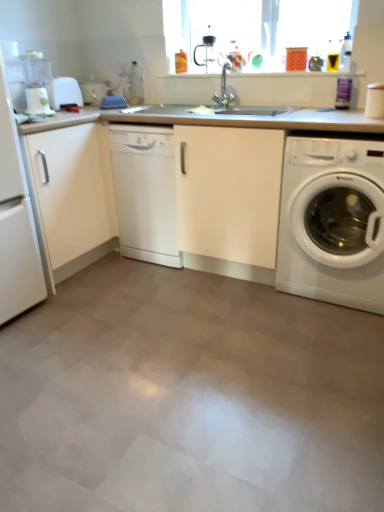
The image size is (384, 512). What do you see at coordinates (259, 195) in the screenshot?
I see `white matte countertop at center` at bounding box center [259, 195].

Consider the image. Measure the distance between point (196, 33) and camera.

2.66 meters.

This screenshot has width=384, height=512. Describe the element at coordinates (64, 92) in the screenshot. I see `white plastic toaster at left, marked as the second appliance in a back-to-front arrangement` at that location.

Find the location of a particular element. Image resolution: width=384 pixels, height=512 pixels. white matte countertop at center is located at coordinates (259, 195).

Considering the points (300, 256) and (322, 56), which point is in front, point (300, 256) or point (322, 56)?

Positioned in front is point (300, 256).

Can you confirm if white matte countertop at center is positioned to the right of transparent glass window screen at upper center?

No, white matte countertop at center is not to the right of transparent glass window screen at upper center.

Is white matte countertop at center inside the boundaries of transparent glass window screen at upper center, or outside?

white matte countertop at center is not inside transparent glass window screen at upper center, it's outside.

Which of these two, white matte countertop at center or transparent glass window screen at upper center, is wider?

white matte countertop at center.

From the image's perspective, is white plastic toaster at left, marked as the second appliance in a back-to-front arrangement, beneath white matte refrigerator at left?

No.

Based on their positions, is white plastic toaster at left, marked as the first appliance in a front-to-back arrangement, located to the left or right of white matte refrigerator at left?

white plastic toaster at left, marked as the first appliance in a front-to-back arrangement, is positioned on white matte refrigerator at left's right side.

Does point (49, 101) lie in front of point (15, 219)?

No.

Is white plastic toaster at left, marked as the first appliance in a front-to-back arrangement, inside or outside of white matte refrigerator at left?

white plastic toaster at left, marked as the first appliance in a front-to-back arrangement, exists outside the volume of white matte refrigerator at left.

Is matte white toaster at upper left, placed as the second appliance when sorted from front to back, positioned with its back to white matte refrigerator at left?

matte white toaster at upper left, placed as the second appliance when sorted from front to back, is not turned away from white matte refrigerator at left.

Find the location of a particular element. This screenshot has height=512, width=384. the 2nd appliance behind the white matte refrigerator at left, starting your count from the anchor is located at coordinates (93, 89).

Is matte white toaster at upper left, placed as the second appliance when sorted from front to back, next to white matte refrigerator at left?

No.

How much distance is there between matte white toaster at upper left, placed as the second appliance when sorted from front to back, and white matte refrigerator at left?

They are 1.15 meters apart.

From a real-world perspective, starting from the white glossy dishwasher at center, which appliance is the 2nd one vertically above it? Please provide its 2D coordinates.

[(93, 89)]

In the scene shown: From the image's perspective, which object appears higher, matte white toaster at upper left, the first appliance positioned from the back, or white glossy dishwasher at center?

matte white toaster at upper left, the first appliance positioned from the back, is shown above in the image.

Does point (99, 88) come farther from viewer compared to point (143, 128)?

Yes, it is.

Are matte white toaster at upper left, placed as the second appliance when sorted from front to back, and white glossy dishwasher at center far apart?

No, matte white toaster at upper left, placed as the second appliance when sorted from front to back, is in close proximity to white glossy dishwasher at center.

Measure the distance between white glossy dishwasher at center and white glossy washing machine at lower right.

They are 33.03 inches apart.

Is white glossy washing machine at lower right located within white glossy dishwasher at center?

No, white glossy washing machine at lower right is not inside white glossy dishwasher at center.

Is white glossy dishwasher at center to the left of white glossy washing machine at lower right from the viewer's perspective?

Yes.

Is white glossy dishwasher at center beside white glossy washing machine at lower right?

There is a gap between white glossy dishwasher at center and white glossy washing machine at lower right.

Considering the sizes of objects white glossy washing machine at lower right and white plastic toaster at left, marked as the second appliance in a back-to-front arrangement, in the image provided, who is thinner, white glossy washing machine at lower right or white plastic toaster at left, marked as the second appliance in a back-to-front arrangement,?

With smaller width is white plastic toaster at left, marked as the second appliance in a back-to-front arrangement.

Is point (310, 254) more distant than point (71, 88)?

No, (310, 254) is closer to viewer.

From a real-world perspective, is white glossy washing machine at lower right located higher than white plastic toaster at left, marked as the second appliance in a back-to-front arrangement?

Incorrect, from a real-world perspective, white glossy washing machine at lower right is lower than white plastic toaster at left, marked as the second appliance in a back-to-front arrangement.

Considering the sizes of objects white glossy washing machine at lower right and white plastic toaster at left, marked as the first appliance in a front-to-back arrangement, in the image provided, who is bigger, white glossy washing machine at lower right or white plastic toaster at left, marked as the first appliance in a front-to-back arrangement,?

white glossy washing machine at lower right.

Could you measure the distance between white matte countertop at center and white glossy washing machine at lower right?

7.79 inches.

Could you tell me if white matte countertop at center is turned towards white glossy washing machine at lower right?

Yes, white matte countertop at center is aimed at white glossy washing machine at lower right.

Can you see white matte countertop at center touching white glossy washing machine at lower right?

No, white matte countertop at center is not beside white glossy washing machine at lower right.

At what (x,y) coordinates should I click in order to perform the action: click on window screen on the right of white matte countertop at center. Please return your answer as a coordinate pair (x, y). The height and width of the screenshot is (512, 384). Looking at the image, I should click on (254, 28).

Find the location of a particular element. This screenshot has height=512, width=384. home appliance directly beneath the white plastic toaster at left, marked as the second appliance in a back-to-front arrangement (from a real-world perspective) is located at coordinates (16, 222).

Which object lies nearer to the anchor point white glossy washing machine at lower right, matte white toaster at upper left, the first appliance positioned from the back, or white matte refrigerator at left?

Based on the image, white matte refrigerator at left appears to be nearer to white glossy washing machine at lower right.

When comparing their distances from matte white toaster at upper left, the first appliance positioned from the back, does white plastic coffee machine at left or transparent glass window screen at upper center seem closer?

Based on the image, white plastic coffee machine at left appears to be nearer to matte white toaster at upper left, the first appliance positioned from the back.

Which object lies nearer to the anchor point white glossy washing machine at lower right, white matte cabinet at left or white plastic coffee machine at left?

white matte cabinet at left lies closer to white glossy washing machine at lower right than the other object.

From the image, which object appears to be farther from white glossy washing machine at lower right, white plastic coffee machine at left or white matte refrigerator at left?

Based on the image, white plastic coffee machine at left appears to be further to white glossy washing machine at lower right.

Looking at the image, which one is located closer to white glossy washing machine at lower right, white matte cabinet at left or white matte countertop at center?

white matte countertop at center is positioned closer to the anchor white glossy washing machine at lower right.

From the image, which object appears to be nearer to matte white toaster at upper left, placed as the second appliance when sorted from front to back, white glossy washing machine at lower right or transparent glass window screen at upper center?

Among the two, transparent glass window screen at upper center is located nearer to matte white toaster at upper left, placed as the second appliance when sorted from front to back.

Estimate the real-world distances between objects in this image. Which object is closer to matte white toaster at upper left, the first appliance positioned from the back, white plastic coffee machine at left or white matte cabinet at left?

white plastic coffee machine at left lies closer to matte white toaster at upper left, the first appliance positioned from the back, than the other object.

When comparing their distances from white matte cabinet at left, does matte white toaster at upper left, the first appliance positioned from the back, or white glossy dishwasher at center seem closer?

Among the two, white glossy dishwasher at center is located nearer to white matte cabinet at left.

At what (x,y) coordinates should I click in order to perform the action: click on counter top between white plastic coffee machine at left and white glossy washing machine at lower right in the horizontal direction. Please return your answer as a coordinate pair (x, y). Looking at the image, I should click on (259, 195).

Find the location of a particular element. appliance between white plastic toaster at left, marked as the first appliance in a front-to-back arrangement, and transparent glass window screen at upper center, in the horizontal direction is located at coordinates (93, 89).

This screenshot has height=512, width=384. I want to click on cabinetry between white matte refrigerator at left and transparent glass window screen at upper center in the horizontal direction, so click(71, 197).

This screenshot has width=384, height=512. In order to click on counter top situated between matte white toaster at upper left, the first appliance positioned from the back, and white glossy washing machine at lower right from left to right in this screenshot , I will do [x=259, y=195].